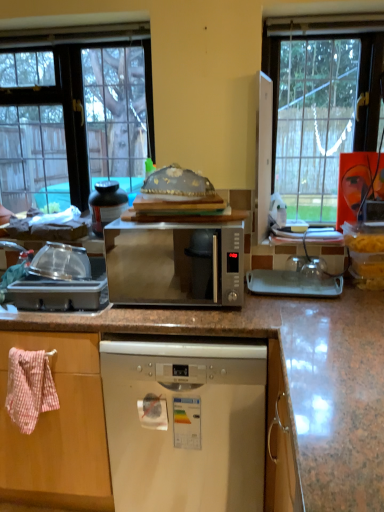
Measure the distance between point (90, 295) and camera.

Point (90, 295) and camera are 1.64 meters apart from each other.

The height and width of the screenshot is (512, 384). In order to click on satin silver microwave at center in this screenshot , I will do `click(175, 263)`.

This screenshot has height=512, width=384. Find the location of `satin silver microwave at center, placed as the 2th appliance when sorted from bottom to top`. satin silver microwave at center, placed as the 2th appliance when sorted from bottom to top is located at coordinates (106, 204).

Identify the location of clear glass window at upper left. (74, 112).

This screenshot has width=384, height=512. Find the location of `clear plastic container at left, which ranks as the first appliance in bottom-to-top order`. clear plastic container at left, which ranks as the first appliance in bottom-to-top order is located at coordinates (58, 281).

Is clear plastic container at left, the first appliance viewed from the front, not near satin silver microwave at center, positioned as the first appliance in top-to-bottom order?

That's not correct — clear plastic container at left, the first appliance viewed from the front, is a little close to satin silver microwave at center, positioned as the first appliance in top-to-bottom order.

Is clear plastic container at left, the 2th appliance from the top, oriented away from satin silver microwave at center, which ranks as the second appliance in front-to-back order?

No, satin silver microwave at center, which ranks as the second appliance in front-to-back order, is not at the back of clear plastic container at left, the 2th appliance from the top.

From a real-world perspective, between clear plastic container at left, which ranks as the first appliance in bottom-to-top order, and satin silver microwave at center, the first appliance viewed from the back, who is vertically higher?

satin silver microwave at center, the first appliance viewed from the back, from a real-world perspective.

Which object is closer to the camera, clear plastic container at left, the 2th appliance from the top, or satin silver microwave at center, positioned as the first appliance in top-to-bottom order?

Positioned in front is clear plastic container at left, the 2th appliance from the top.

You are a GUI agent. You are given a task and a screenshot of the screen. Output one action in this format:
    pyautogui.click(x=<x>, y=<y>)
    Task: Click on the window to the left of satin silver microwave at center, positioned as the first appliance in top-to-bottom order
    This screenshot has height=512, width=384.
    Given the screenshot: What is the action you would take?
    pyautogui.click(x=74, y=112)

Is satin silver microwave at center, positioned as the first appliance in top-to-bottom order, thinner than clear glass window at upper left?

Yes.

Which of these two, satin silver microwave at center, the first appliance viewed from the back, or clear glass window at upper left, stands shorter?

satin silver microwave at center, the first appliance viewed from the back.

Is point (93, 221) behind point (123, 66)?

No, it is in front of (123, 66).

Is satin silver microwave at center in front of clear plastic container at left, the first appliance viewed from the front?

Yes.

In the scene shown: Considering the sizes of satin silver microwave at center and clear plastic container at left, the second appliance viewed from the back, in the image, is satin silver microwave at center taller or shorter than clear plastic container at left, the second appliance viewed from the back,?

Clearly, satin silver microwave at center is taller compared to clear plastic container at left, the second appliance viewed from the back.

Is satin silver microwave at center not within clear plastic container at left, which ranks as the first appliance in bottom-to-top order?

Yes, satin silver microwave at center is located beyond the bounds of clear plastic container at left, which ranks as the first appliance in bottom-to-top order.

Is satin silver microwave at center wider or thinner than clear plastic container at left, the first appliance viewed from the front?

Clearly, satin silver microwave at center has more width compared to clear plastic container at left, the first appliance viewed from the front.

Does pink woven towel at left turn towards satin silver microwave at center?

No, pink woven towel at left is not oriented towards satin silver microwave at center.

Considering the relative positions of pink woven towel at left and satin silver microwave at center in the image provided, is pink woven towel at left to the left or to the right of satin silver microwave at center?

From the image, it's evident that pink woven towel at left is to the left of satin silver microwave at center.

Considering the sizes of pink woven towel at left and satin silver microwave at center in the image, is pink woven towel at left bigger or smaller than satin silver microwave at center?

Considering their sizes, pink woven towel at left takes up less space than satin silver microwave at center.

Which is behind, pink woven towel at left or satin silver microwave at center?

pink woven towel at left is further away from the camera.

Is the surface of satin silver dishwasher at center in direct contact with clear glass window at upper left?

They are not placed beside each other.

Which of these two, satin silver dishwasher at center or clear glass window at upper left, is smaller?

clear glass window at upper left.

Considering the points (137, 482) and (65, 149), which point is in front, point (137, 482) or point (65, 149)?

The point (137, 482) is closer.

Locate an element on the screen. Image resolution: width=384 pixels, height=512 pixels. dishwasher below the clear glass window at upper left (from a real-world perspective) is located at coordinates (185, 424).

Is the depth of clear glass window at upper left greater than that of clear plastic container at left, the second appliance viewed from the back?

Yes, clear glass window at upper left is further from the viewer.

From the image's perspective, between clear glass window at upper left and clear plastic container at left, the second appliance viewed from the back, which one is located above?

clear glass window at upper left is shown above in the image.

From a real-world perspective, does clear glass window at upper left sit lower than clear plastic container at left, which ranks as the first appliance in bottom-to-top order?

No.

Does point (123, 151) appear closer or farther from the camera than point (77, 280)?

Point (123, 151) is positioned farther from the camera compared to point (77, 280).

Could you measure the distance between satin silver dishwasher at center and satin silver microwave at center, placed as the 2th appliance when sorted from bottom to top?

A distance of 91.05 centimeters exists between satin silver dishwasher at center and satin silver microwave at center, placed as the 2th appliance when sorted from bottom to top.

Is satin silver dishwasher at center in contact with satin silver microwave at center, the first appliance viewed from the back?

There is a gap between satin silver dishwasher at center and satin silver microwave at center, the first appliance viewed from the back.

Is satin silver dishwasher at center oriented away from satin silver microwave at center, positioned as the first appliance in top-to-bottom order?

No, satin silver dishwasher at center is not facing away from satin silver microwave at center, positioned as the first appliance in top-to-bottom order.

There is a clear plastic container at left, which ranks as the first appliance in bottom-to-top order. Find the location of `appliance above it (from a real-world perspective)`. appliance above it (from a real-world perspective) is located at coordinates (106, 204).

The image size is (384, 512). In order to click on appliance that is the 2nd object to the right of the clear glass window at upper left, starting at the anchor in this screenshot , I will do `click(106, 204)`.

Estimate the real-world distances between objects in this image. Which object is closer to clear plastic container at left, the second appliance viewed from the back, satin silver dishwasher at center or satin silver microwave at center, positioned as the first appliance in top-to-bottom order?

satin silver microwave at center, positioned as the first appliance in top-to-bottom order.

Based on their spatial positions, is satin silver dishwasher at center or satin silver microwave at center further from satin silver microwave at center, placed as the 2th appliance when sorted from bottom to top?

satin silver dishwasher at center is positioned further to the anchor satin silver microwave at center, placed as the 2th appliance when sorted from bottom to top.

Based on their spatial positions, is satin silver microwave at center, placed as the 2th appliance when sorted from bottom to top, or clear glass window at upper left further from satin silver dishwasher at center?

Based on the image, clear glass window at upper left appears to be further to satin silver dishwasher at center.

When comparing their distances from clear plastic container at left, the second appliance viewed from the back, does satin silver microwave at center, positioned as the first appliance in top-to-bottom order, or satin silver microwave at center seem further?

satin silver microwave at center, positioned as the first appliance in top-to-bottom order, is further to clear plastic container at left, the second appliance viewed from the back.

Looking at the image, which one is located closer to clear glass window at upper left, satin silver microwave at center or satin silver microwave at center, which ranks as the second appliance in front-to-back order?

satin silver microwave at center, which ranks as the second appliance in front-to-back order, is closer to clear glass window at upper left.

From the picture: From the image, which object appears to be nearer to satin silver dishwasher at center, clear plastic container at left, the 2th appliance from the top, or clear glass window at upper left?

Based on the image, clear plastic container at left, the 2th appliance from the top, appears to be nearer to satin silver dishwasher at center.

When comparing their distances from satin silver microwave at center, does clear glass window at upper left or satin silver dishwasher at center seem closer?

satin silver dishwasher at center is closer to satin silver microwave at center.

Looking at this image, based on their spatial positions, is clear plastic container at left, the 2th appliance from the top, or pink woven towel at left further from satin silver microwave at center?

pink woven towel at left lies further to satin silver microwave at center than the other object.

The height and width of the screenshot is (512, 384). I want to click on appliance between clear glass window at upper left and clear plastic container at left, the 2th appliance from the top, vertically, so click(106, 204).

At what (x,y) coordinates should I click in order to perform the action: click on microwave oven that lies between clear glass window at upper left and satin silver dishwasher at center from top to bottom. Please return your answer as a coordinate pair (x, y). Looking at the image, I should click on (175, 263).

Where is `material that lies between clear glass window at upper left and satin silver dishwasher at center from top to bottom`? The width and height of the screenshot is (384, 512). material that lies between clear glass window at upper left and satin silver dishwasher at center from top to bottom is located at coordinates (30, 387).

Where is `appliance that lies between satin silver microwave at center and satin silver dishwasher at center from top to bottom`? Image resolution: width=384 pixels, height=512 pixels. appliance that lies between satin silver microwave at center and satin silver dishwasher at center from top to bottom is located at coordinates (58, 281).